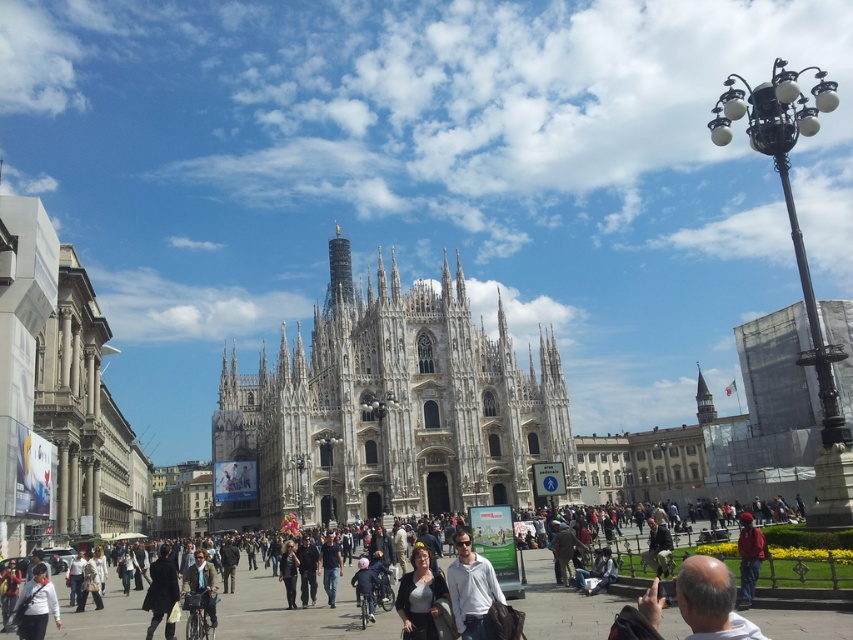
Is point (544, 628) behind point (422, 624)?

That is True.

Is dark gray clothing at center thinner than matte black jacket at center?

No.

Which is in front, point (137, 618) or point (416, 611)?

Point (416, 611)

In order to click on dark gray clothing at center in this screenshot , I will do pyautogui.click(x=293, y=611).

Is point (461, 550) closer to camera compared to point (445, 595)?

No, it is behind (445, 595).

Which is above, white matte jacket at center or matte black jacket at center?

white matte jacket at center is above.

The image size is (853, 640). What are the coordinates of `white matte jacket at center` in the screenshot? It's located at (471, 588).

The image size is (853, 640). I want to click on white matte jacket at center, so click(471, 588).

Does white matte jacket at lower left lie behind red fabric jacket at lower right?

No.

Consider the image. Who is lower down, white matte jacket at lower left or red fabric jacket at lower right?

white matte jacket at lower left is lower down.

Does point (22, 596) lie in front of point (756, 570)?

That is True.

Locate an element on the screen. This screenshot has height=640, width=853. white matte jacket at lower left is located at coordinates (35, 605).